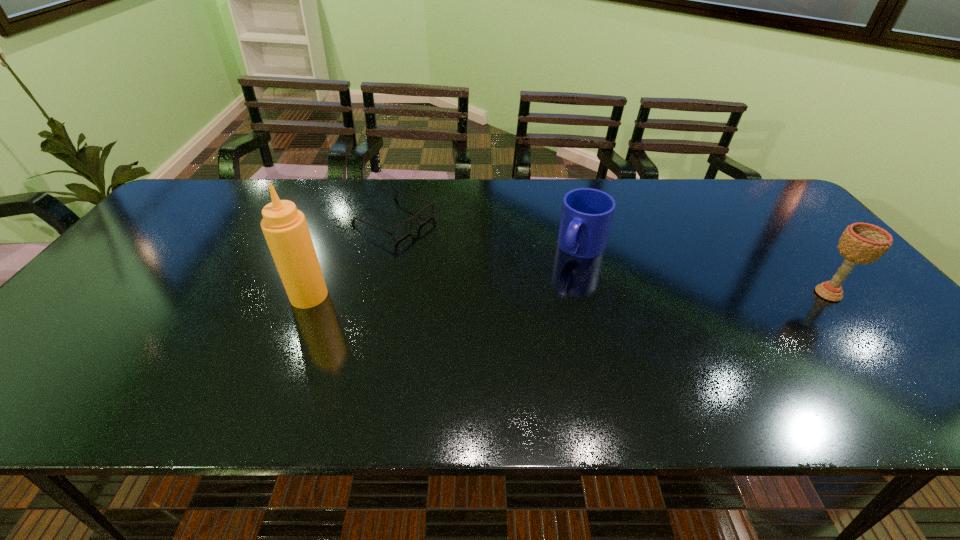
At what (x,y) coordinates should I click in order to perform the action: click on vacant area at the far left corner of the desktop. Please return your answer as a coordinate pair (x, y). This screenshot has height=540, width=960. Looking at the image, I should click on (201, 218).

The image size is (960, 540). In order to click on free space between the second tallest object and the spectacles in this screenshot , I will do `click(612, 257)`.

Where is `vacant point located between the tallest object and the third tallest object`? vacant point located between the tallest object and the third tallest object is located at coordinates (445, 272).

Where is `free space between the spectacles and the chalice`? free space between the spectacles and the chalice is located at coordinates (612, 257).

Locate an element on the screen. free spot between the condiment and the second shortest object is located at coordinates (445, 272).

Locate an element on the screen. The height and width of the screenshot is (540, 960). empty space that is in between the spectacles and the tallest object is located at coordinates (351, 258).

Locate an element on the screen. This screenshot has height=540, width=960. empty space that is in between the rightmost object and the spectacles is located at coordinates (612, 257).

The width and height of the screenshot is (960, 540). What are the coordinates of `empty space that is in between the tallest object and the spectacles` in the screenshot? It's located at (351, 258).

Identify the location of vacant area that lies between the shortest object and the tallest object. (351, 258).

Locate an element on the screen. This screenshot has width=960, height=540. unoccupied area between the mug and the rightmost object is located at coordinates (705, 271).